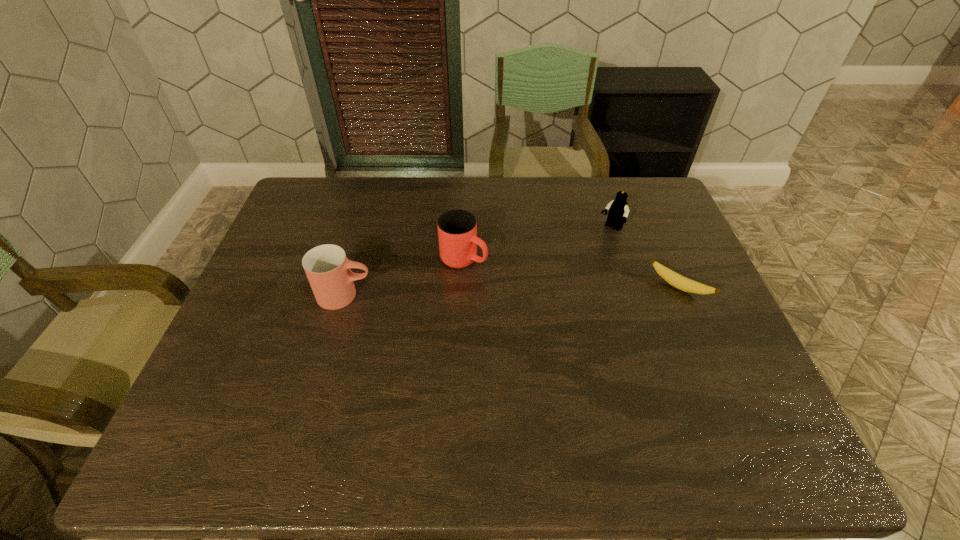
The width and height of the screenshot is (960, 540). Identify the location of free region at the right edge of the desktop. (705, 315).

Where is `free space at the far left corner of the desktop`? free space at the far left corner of the desktop is located at coordinates (332, 177).

Where is `vacant space at the far right corner of the desktop`? The width and height of the screenshot is (960, 540). vacant space at the far right corner of the desktop is located at coordinates (639, 199).

Where is `vacant region between the Lego and the second object from left to right`? The image size is (960, 540). vacant region between the Lego and the second object from left to right is located at coordinates (538, 244).

The height and width of the screenshot is (540, 960). In order to click on free spot between the leftmost object and the farther cup in this screenshot , I will do `click(404, 277)`.

Where is `free spot between the right cup and the nearer cup`? free spot between the right cup and the nearer cup is located at coordinates (404, 277).

The height and width of the screenshot is (540, 960). I want to click on vacant point located between the farther cup and the shortest object, so click(571, 273).

Identify the location of free area in between the third object from left to right and the rightmost object. (645, 258).

In order to click on free space between the farthest object and the third object from right to left in this screenshot , I will do `click(538, 244)`.

Where is `object that is the closest to the second object from right to left`? This screenshot has width=960, height=540. object that is the closest to the second object from right to left is located at coordinates (685, 284).